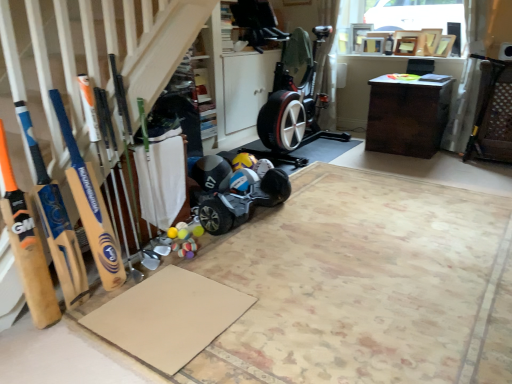
Question: Can you confirm if black rubber baby carriage at center is positioned to the right of beige cardboard at lower left, marked as the 2th yoga mat in a back-to-front arrangement?

Choices:
 (A) yes
 (B) no

Answer: (B)

Question: Is black rubber baby carriage at center facing away from beige cardboard at lower left, marked as the 2th yoga mat in a back-to-front arrangement?

Choices:
 (A) no
 (B) yes

Answer: (A)

Question: Would you say black rubber baby carriage at center is outside beige cardboard at lower left, marked as the 2th yoga mat in a back-to-front arrangement?

Choices:
 (A) no
 (B) yes

Answer: (B)

Question: Are black rubber baby carriage at center and beige cardboard at lower left, the 1th yoga mat positioned from the front, beside each other?

Choices:
 (A) no
 (B) yes

Answer: (A)

Question: From the image's perspective, is black rubber baby carriage at center located above beige cardboard at lower left, marked as the 2th yoga mat in a back-to-front arrangement?

Choices:
 (A) yes
 (B) no

Answer: (A)

Question: From the image's perspective, is black rubber baby carriage at center beneath beige cardboard at lower left, the 1th yoga mat positioned from the front?

Choices:
 (A) yes
 (B) no

Answer: (B)

Question: Can you confirm if black rubber baby carriage at center is smaller than brown cardboard yoga mat at lower left, the 1th yoga mat positioned from the back?

Choices:
 (A) no
 (B) yes

Answer: (A)

Question: Is black rubber baby carriage at center wider than brown cardboard yoga mat at lower left, acting as the second yoga mat starting from the front?

Choices:
 (A) no
 (B) yes

Answer: (A)

Question: Does black rubber baby carriage at center appear on the right side of brown cardboard yoga mat at lower left, the 1th yoga mat positioned from the back?

Choices:
 (A) no
 (B) yes

Answer: (B)

Question: From a real-world perspective, is black rubber baby carriage at center on brown cardboard yoga mat at lower left, the 1th yoga mat positioned from the back?

Choices:
 (A) no
 (B) yes

Answer: (B)

Question: Is black rubber baby carriage at center outside brown cardboard yoga mat at lower left, the 1th yoga mat positioned from the back?

Choices:
 (A) no
 (B) yes

Answer: (B)

Question: Is black rubber baby carriage at center further to camera compared to brown cardboard yoga mat at lower left, acting as the second yoga mat starting from the front?

Choices:
 (A) no
 (B) yes

Answer: (B)

Question: Can you see matte black helmet at center touching wooden bat at left, placed as the first baseball bat when sorted from right to left?

Choices:
 (A) yes
 (B) no

Answer: (B)